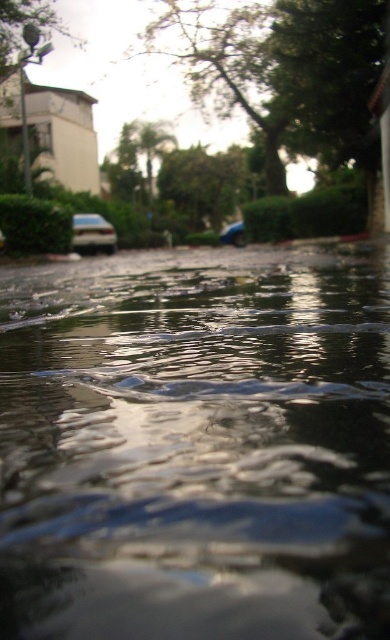
Question: Which point is closer to the camera taking this photo?

Choices:
 (A) (81, 333)
 (B) (232, 224)
 (C) (72, 216)

Answer: (A)

Question: Is transparent liquid at center below metallic blue car at center?

Choices:
 (A) no
 (B) yes

Answer: (B)

Question: Which point is farther to the camera?

Choices:
 (A) (244, 241)
 (B) (74, 221)

Answer: (A)

Question: Can you confirm if transparent liquid at center is bigger than metallic blue car at center?

Choices:
 (A) yes
 (B) no

Answer: (B)

Question: Among these objects, which one is nearest to the camera?

Choices:
 (A) transparent liquid at center
 (B) metallic silver car at lower left
 (C) metallic blue car at center

Answer: (A)

Question: Does transparent liquid at center lie behind metallic silver car at lower left?

Choices:
 (A) yes
 (B) no

Answer: (B)